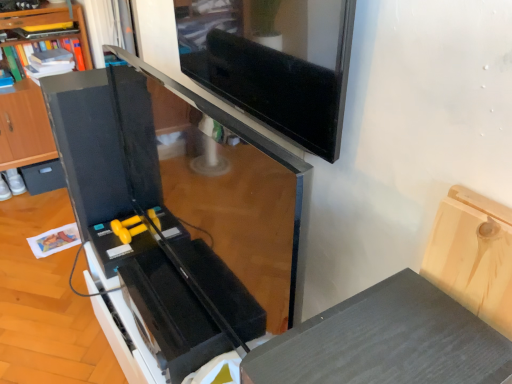
Question: Is the surface of black matte drawer at lower left in direct contact with black matte shelf at left?

Choices:
 (A) yes
 (B) no

Answer: (B)

Question: From a real-world perspective, does black matte drawer at lower left stand above black matte shelf at left?

Choices:
 (A) no
 (B) yes

Answer: (A)

Question: Can you confirm if black matte drawer at lower left is wider than black matte shelf at left?

Choices:
 (A) yes
 (B) no

Answer: (B)

Question: Does black matte drawer at lower left appear on the right side of black matte shelf at left?

Choices:
 (A) no
 (B) yes

Answer: (A)

Question: Considering the relative sizes of black matte drawer at lower left and black matte shelf at left in the image provided, is black matte drawer at lower left shorter than black matte shelf at left?

Choices:
 (A) no
 (B) yes

Answer: (B)

Question: Would you say black matte drawer at lower left contains black matte shelf at left?

Choices:
 (A) no
 (B) yes

Answer: (A)

Question: Is black matte shelf at left positioned before black matte drawer at lower left?

Choices:
 (A) yes
 (B) no

Answer: (A)

Question: Considering the relative positions of black matte shelf at left and black matte drawer at lower left in the image provided, is black matte shelf at left to the right of black matte drawer at lower left from the viewer's perspective?

Choices:
 (A) yes
 (B) no

Answer: (A)

Question: Does black matte shelf at left have a greater width compared to black matte drawer at lower left?

Choices:
 (A) yes
 (B) no

Answer: (A)

Question: Can you confirm if black matte shelf at left is shorter than black matte drawer at lower left?

Choices:
 (A) no
 (B) yes

Answer: (A)

Question: Is black matte shelf at left not near black matte drawer at lower left?

Choices:
 (A) yes
 (B) no

Answer: (B)

Question: Can you confirm if black matte shelf at left is bigger than black matte drawer at lower left?

Choices:
 (A) no
 (B) yes

Answer: (B)

Question: Is black matte shelf at left wider or thinner than black matte drawer at lower left?

Choices:
 (A) thin
 (B) wide

Answer: (B)